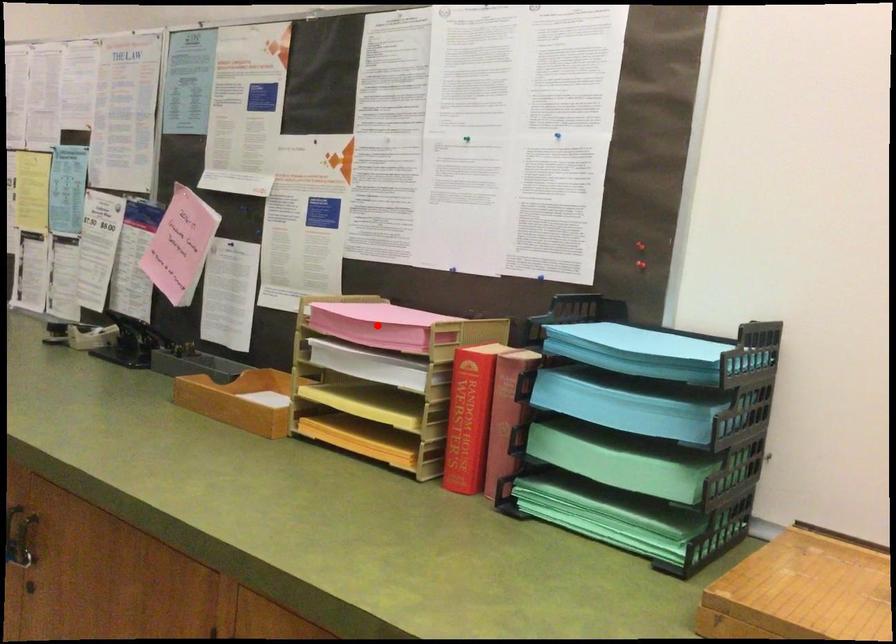
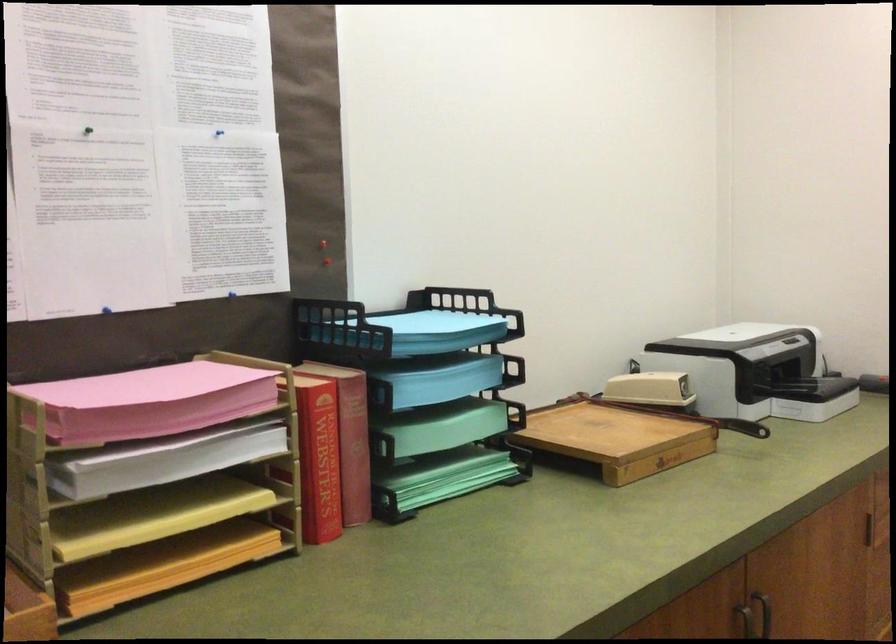
Find the pixel in the second image that matches the highlighted location in the first image.

(171, 406)